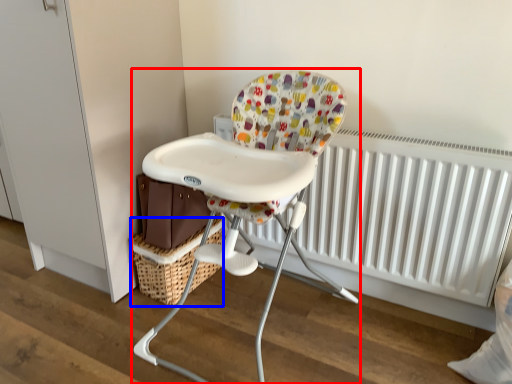
Question: Which point is closer to the camera, chair (highlighted by a red box) or basket (highlighted by a blue box)?

Choices:
 (A) chair
 (B) basket

Answer: (A)